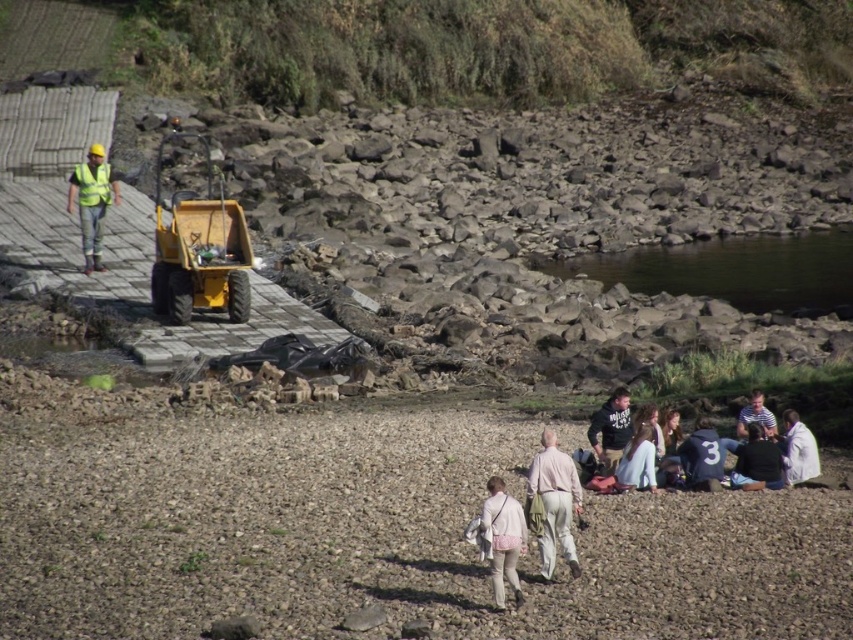
You are a safety inspector at the construction site. You need to ensure that the distance between the worker wearing light beige pants at center and the supervisor in yellow reflective vest at left meets the safety regulation of minimum 20 meters. Based on the scene description, does this distance comply with the regulation?

The distance between the light beige pants at center and the yellow reflective vest at left is 19.27 meters, which is less than the required 20 meters. Therefore, it does not comply with the safety regulation.

You are a surveyor trying to locate the light beige cotton pants at center in the image. According to the coordinates provided, where exactly would you find them?

The light beige cotton pants at center are located at the coordinates point [554,502].

You are a surveyor trying to map the coordinates of objects in the image. The image has a coordinate system where the bottom left corner is the origin. Where is the light beige pants at center located in this coordinate system?

The light beige pants at center is located at point (503,540) in the coordinate system.